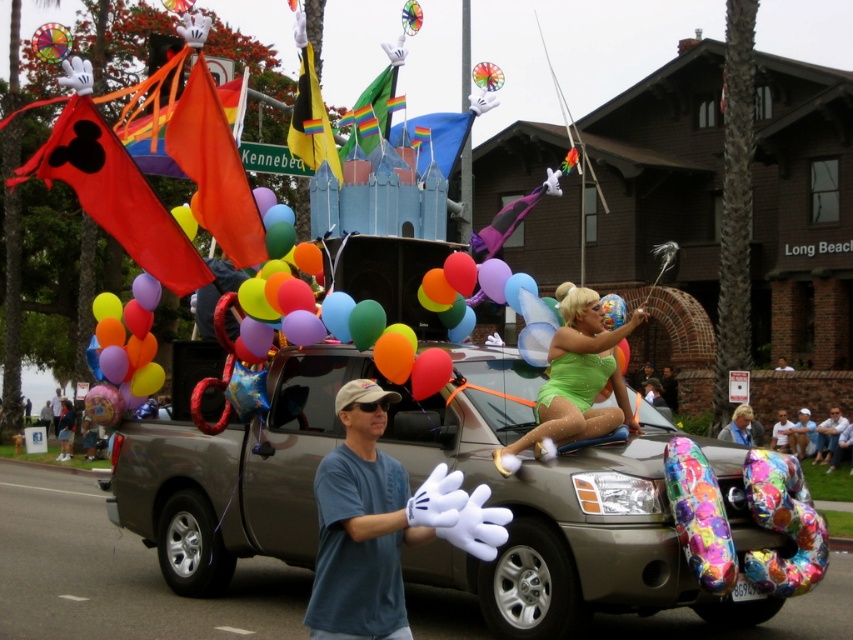
The width and height of the screenshot is (853, 640). What do you see at coordinates (369, 524) in the screenshot? I see `white fabric gloves at center` at bounding box center [369, 524].

Between white fabric gloves at center and blue denim shirt at center, which one appears on the left side from the viewer's perspective?

From the viewer's perspective, white fabric gloves at center appears more on the left side.

The image size is (853, 640). Identify the location of white fabric gloves at center. pos(369,524).

This screenshot has width=853, height=640. What are the coordinates of `white fabric gloves at center` in the screenshot? It's located at [x=369, y=524].

Can you confirm if red fabric flag at upper left is positioned above blue fabric flag at center?

No, red fabric flag at upper left is not above blue fabric flag at center.

Locate an element on the screen. red fabric flag at upper left is located at coordinates (114, 193).

Is orange fabric flag at upper center shorter than blue fabric glove at center?

No.

Does orange fabric flag at upper center appear under blue fabric glove at center?

No.

Is point (238, 216) behind point (54, 419)?

No.

Find the location of a particular element. Image resolution: width=853 pixels, height=640 pixels. orange fabric flag at upper center is located at coordinates (213, 168).